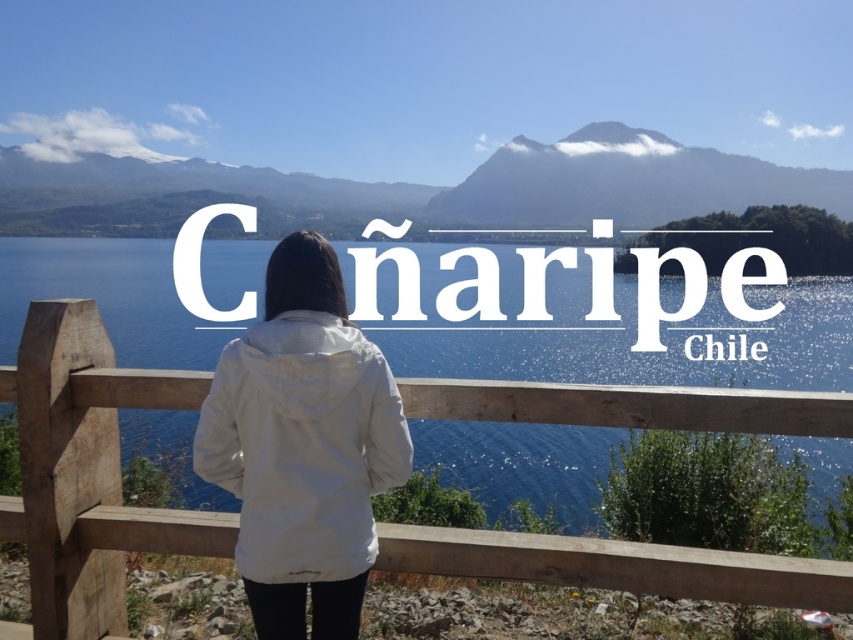
You are standing at the viewpoint and want to take a photo of the scenic lake and mountains. There is a person wearing a white fabric jacket at center in your shot. Where should you move to avoid them while still capturing the entire scene?

Move to the left or right of the white fabric jacket at center since it is located at point [303,445], which is near the center of the image. Shifting your position slightly left or right will allow you to exclude the person while keeping the lake and mountains in frame.

You are standing at the viewpoint and want to take a photo of the snowy mountain at upper center without any obstructions. Is the white fabric jacket at center blocking your view?

The white fabric jacket at center is shorter than the snowy mountain at upper center, so the jacket will not block your view of the mountain.

You are a photographer planning to capture a wide shot of the scenic view. You need to ensure that both the wooden at center and the white fabric jacket at center are fully visible in the frame. Based on their relative sizes, which object should you prioritize positioning closer to the camera to ensure both fit within the frame?

The wooden at center is wider than the white fabric jacket at center. To ensure both fit within the frame, prioritize positioning the wooden at center closer to the camera since its larger width requires more space in the shot.